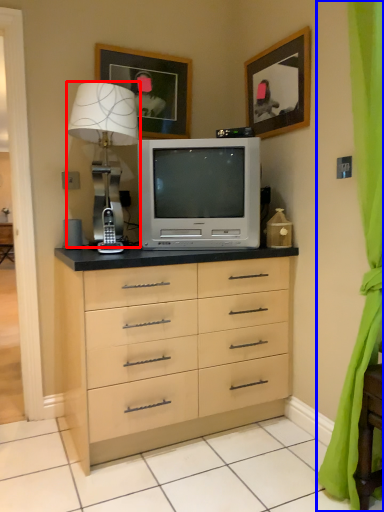
Question: Among these objects, which one is farthest to the camera, table lamp (highlighted by a red box) or curtain (highlighted by a blue box)?

Choices:
 (A) table lamp
 (B) curtain

Answer: (A)